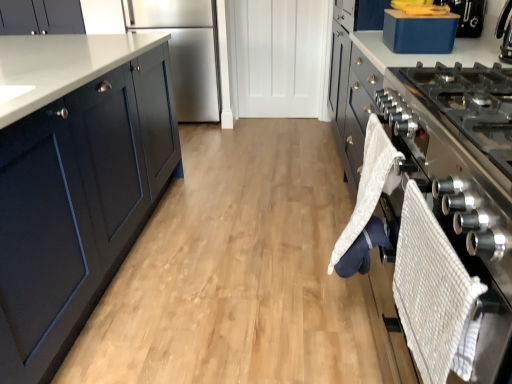
Question: Does satin silver oven at right have a greater width compared to blue plastic container at upper right?

Choices:
 (A) yes
 (B) no

Answer: (A)

Question: Are satin silver oven at right and blue plastic container at upper right located far from each other?

Choices:
 (A) no
 (B) yes

Answer: (A)

Question: From a real-world perspective, is satin silver oven at right over blue plastic container at upper right?

Choices:
 (A) yes
 (B) no

Answer: (B)

Question: From the image's perspective, is satin silver oven at right on top of blue plastic container at upper right?

Choices:
 (A) yes
 (B) no

Answer: (B)

Question: Can you confirm if satin silver oven at right is bigger than blue plastic container at upper right?

Choices:
 (A) yes
 (B) no

Answer: (A)

Question: Is point (18, 26) positioned closer to the camera than point (500, 221)?

Choices:
 (A) closer
 (B) farther

Answer: (B)

Question: Is matte dark blue cabinet at upper left situated inside satin silver oven at right or outside?

Choices:
 (A) inside
 (B) outside

Answer: (B)

Question: Based on their positions, is matte dark blue cabinet at upper left located to the left or right of satin silver oven at right?

Choices:
 (A) left
 (B) right

Answer: (A)

Question: From the image's perspective, is matte dark blue cabinet at upper left located above or below satin silver oven at right?

Choices:
 (A) below
 (B) above

Answer: (B)

Question: Would you say stainless steel refrigerator at center is to the left or to the right of satin silver oven at right in the picture?

Choices:
 (A) left
 (B) right

Answer: (A)

Question: From their relative heights in the image, would you say stainless steel refrigerator at center is taller or shorter than satin silver oven at right?

Choices:
 (A) short
 (B) tall

Answer: (B)

Question: Do you think stainless steel refrigerator at center is within satin silver oven at right, or outside of it?

Choices:
 (A) outside
 (B) inside

Answer: (A)

Question: Is stainless steel refrigerator at center wider or thinner than satin silver oven at right?

Choices:
 (A) wide
 (B) thin

Answer: (B)

Question: Is blue plastic container at upper right in front of or behind satin silver oven at right in the image?

Choices:
 (A) behind
 (B) front

Answer: (A)

Question: Is point (398, 39) closer or farther from the camera than point (384, 120)?

Choices:
 (A) closer
 (B) farther

Answer: (B)